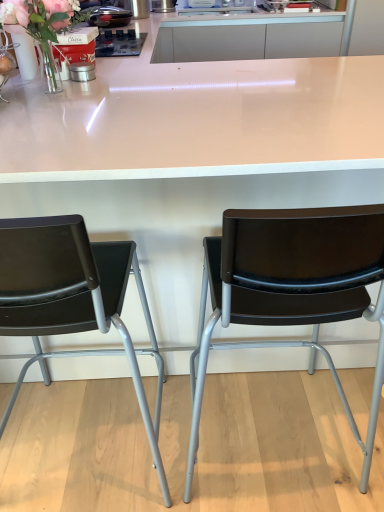
Find the location of a particular element. This screenshot has width=384, height=512. vacant region in front of clear glass vase at left is located at coordinates (43, 77).